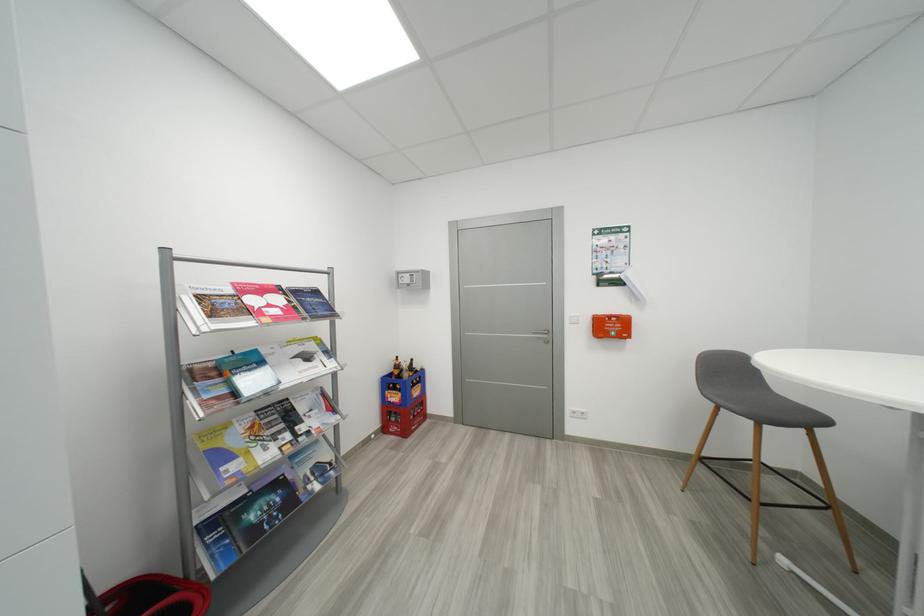
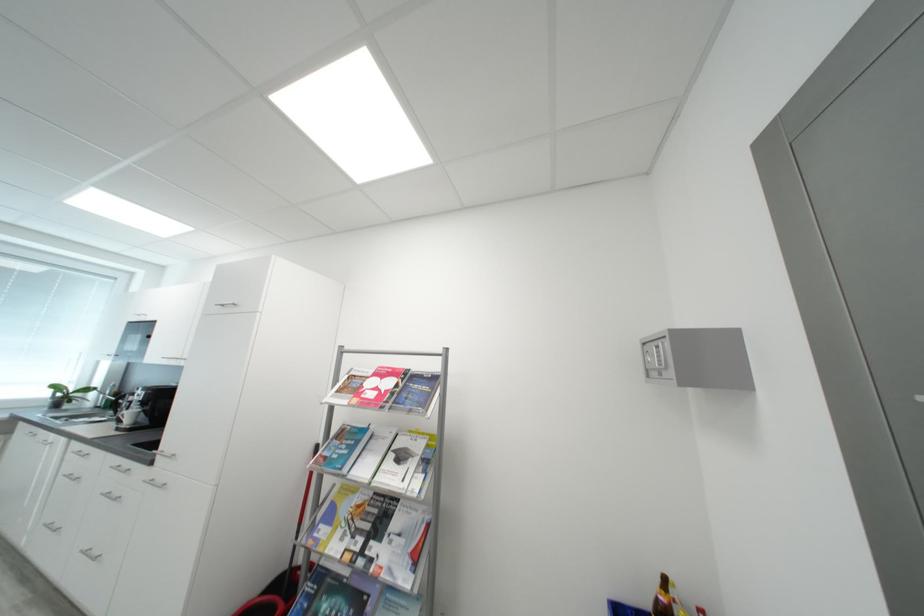
Find the pixel in the second image that matches (309,430) in the first image.

(380, 549)